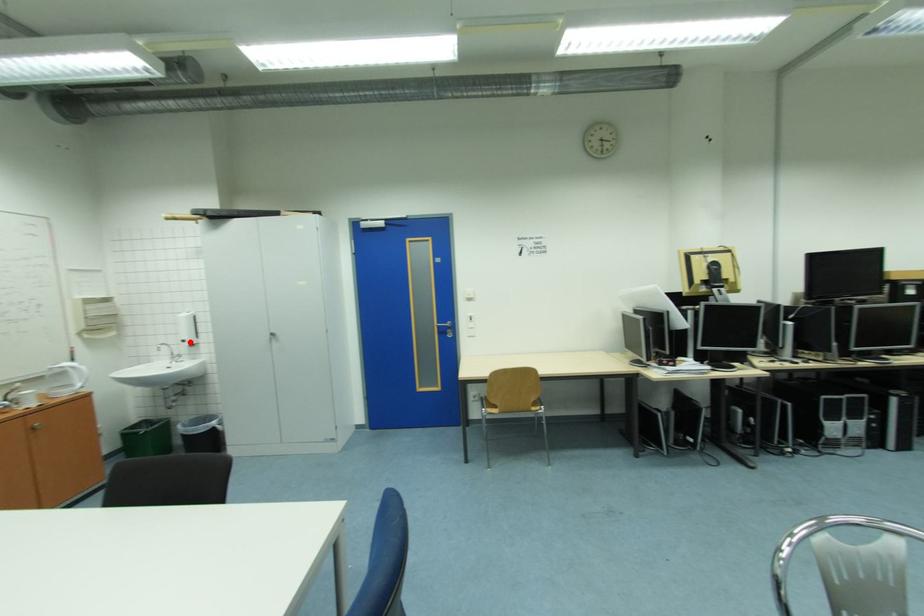
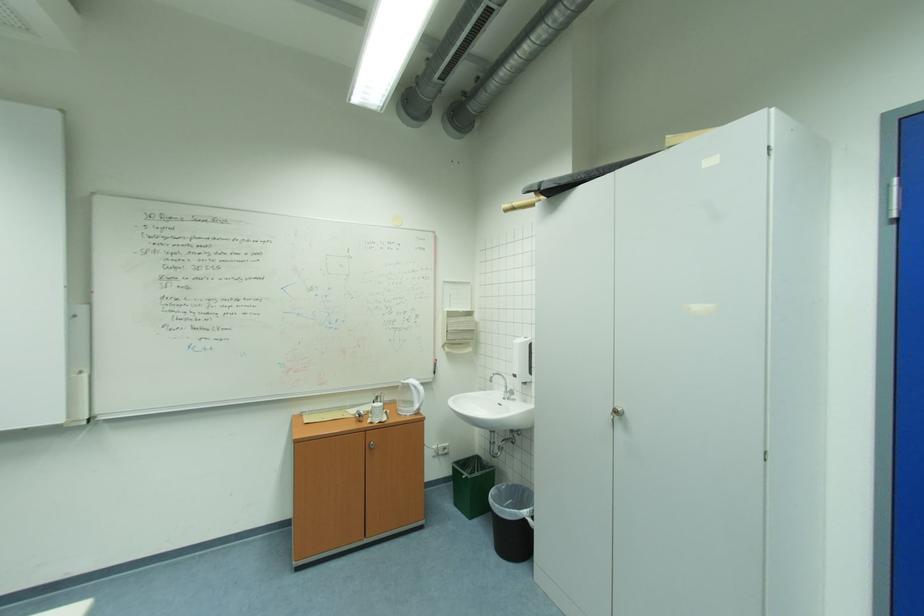
In the second image, find the point that corresponds to the highlighted location in the first image.

(523, 377)